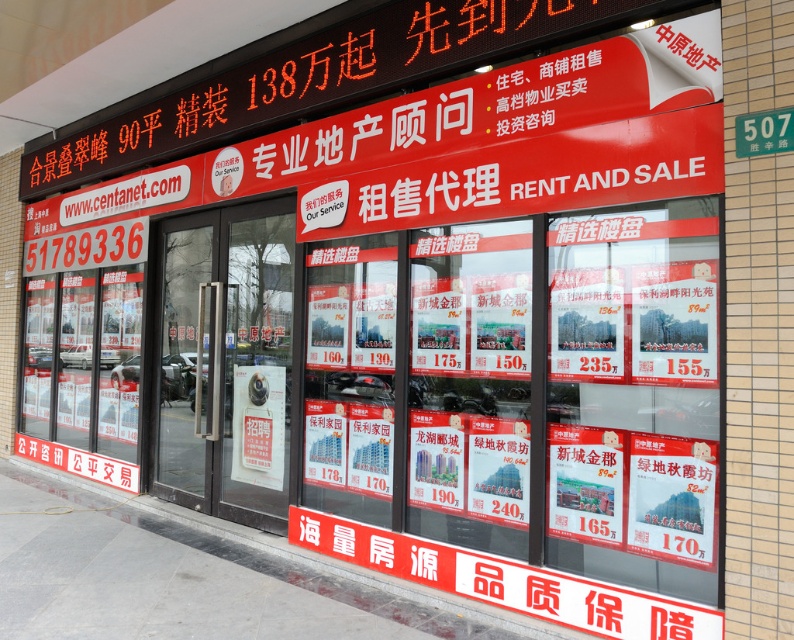
Is the position of white paper posters at center less distant than that of transparent glass door at center?

Yes, white paper posters at center is in front of transparent glass door at center.

Which is more to the right, white paper posters at center or transparent glass door at center?

white paper posters at center is more to the right.

Identify the location of white paper posters at center. The height and width of the screenshot is (640, 794). (575, 387).

Can you confirm if red glossy poster at center is positioned to the right of green metallic street sign at upper right?

No, red glossy poster at center is not to the right of green metallic street sign at upper right.

Is point (676, 506) farther from viewer compared to point (744, 140)?

Yes, point (676, 506) is farther from viewer.

At what (x,y) coordinates should I click in order to perform the action: click on red glossy poster at center. Please return your answer as a coordinate pair (x, y). This screenshot has width=794, height=640. Looking at the image, I should click on (673, 499).

This screenshot has width=794, height=640. What do you see at coordinates (575, 387) in the screenshot?
I see `white paper posters at center` at bounding box center [575, 387].

Consider the image. Does white paper posters at center appear under green metallic street sign at upper right?

Correct, white paper posters at center is located below green metallic street sign at upper right.

Which is behind, point (673, 346) or point (781, 147)?

The point (673, 346) is behind.

This screenshot has width=794, height=640. I want to click on white paper posters at center, so click(x=575, y=387).